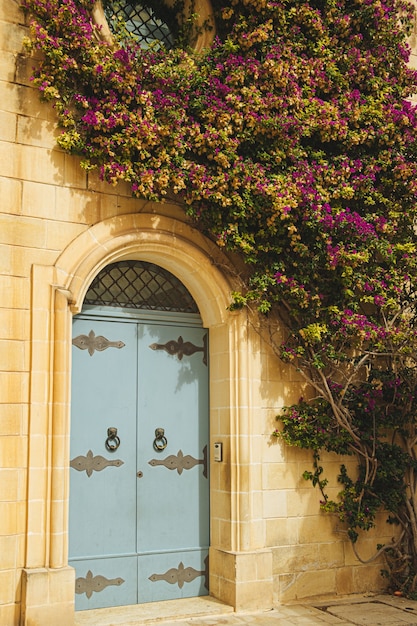
Where is `left of doorway arch`? left of doorway arch is located at coordinates (53, 443).